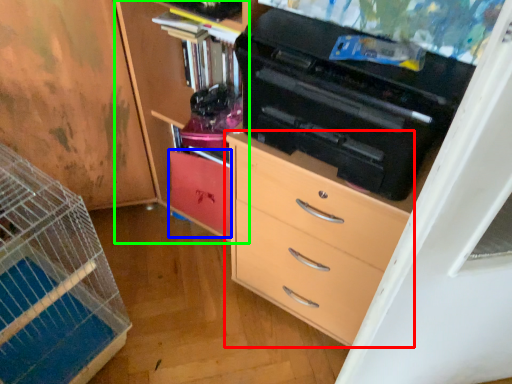
Question: Which object is positioned closest to chest of drawers (highlighted by a red box)? Select from cabinetry (highlighted by a blue box) and cabinetry (highlighted by a green box).

Choices:
 (A) cabinetry
 (B) cabinetry

Answer: (B)